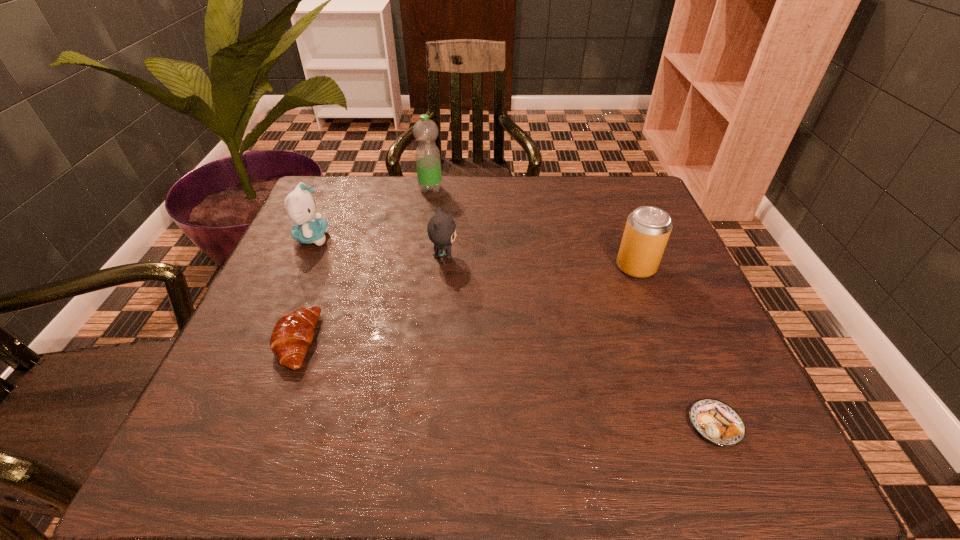
The width and height of the screenshot is (960, 540). I want to click on the farthest object, so click(428, 164).

Where is `water bottle`? The width and height of the screenshot is (960, 540). water bottle is located at coordinates (428, 164).

Locate an element on the screen. The width and height of the screenshot is (960, 540). pop (soda) is located at coordinates (647, 230).

Locate an element on the screen. Image resolution: width=960 pixels, height=540 pixels. the left kitten is located at coordinates (300, 205).

Where is `the shorter kitten`? The height and width of the screenshot is (540, 960). the shorter kitten is located at coordinates (441, 229).

Locate an element on the screen. the right kitten is located at coordinates (441, 229).

Locate an element on the screen. Image resolution: width=960 pixels, height=540 pixels. the fifth farthest object is located at coordinates (293, 333).

Where is `crescent roll`? This screenshot has width=960, height=540. crescent roll is located at coordinates (x=293, y=333).

The width and height of the screenshot is (960, 540). What are the coordinates of `the nearest object` in the screenshot? It's located at 717,422.

At what (x,y) coordinates should I click in order to perform the action: click on the shortest object. Please return your answer as a coordinate pair (x, y). The height and width of the screenshot is (540, 960). Looking at the image, I should click on (717, 422).